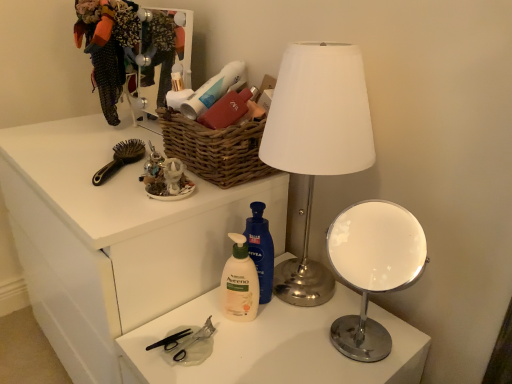
Locate an element on the screen. vacant space that is in between black plastic brush at upper left and patterned fabric dress at upper left is located at coordinates (108, 143).